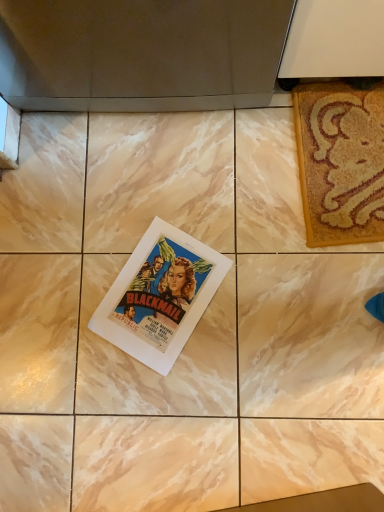
Where is `free space above white paper at center (from a real-world perspective)`? Image resolution: width=384 pixels, height=512 pixels. free space above white paper at center (from a real-world perspective) is located at coordinates (165, 287).